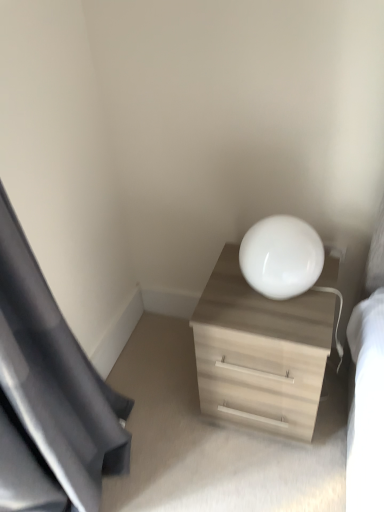
The width and height of the screenshot is (384, 512). Identify the location of vacant space in front of white glossy lampshade at upper right. (288, 326).